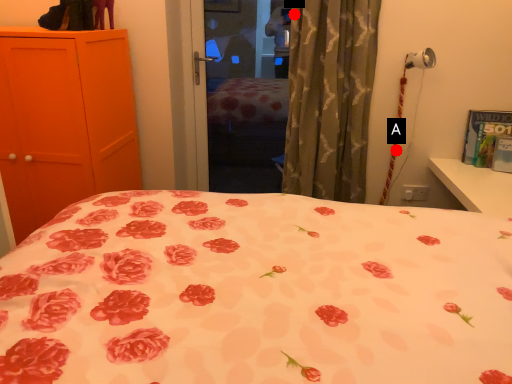
Question: Two points are circled on the image, labeled by A and B beside each circle. Among these points, which one is nearest to the camera?

Choices:
 (A) A is closer
 (B) B is closer

Answer: (B)